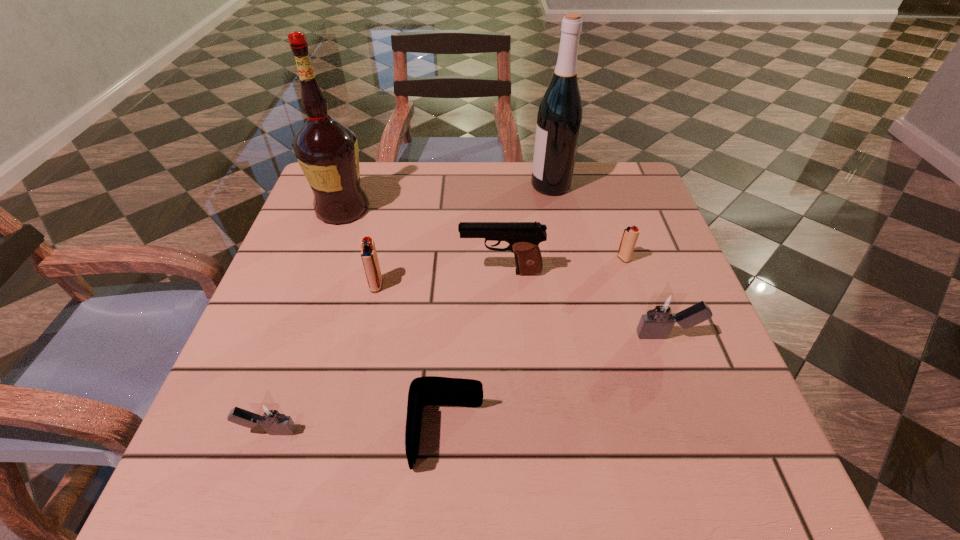
This screenshot has width=960, height=540. I want to click on free location located at the barrel of the pistol, so click(x=319, y=272).

Find the location of a particular element. The image size is (960, 540). vacant region located on the back of the bigger gray igniter is located at coordinates point(636,248).

The image size is (960, 540). Find the location of `vacant space positioned 0.210m on the right of the nearer red igniter`. vacant space positioned 0.210m on the right of the nearer red igniter is located at coordinates (484, 285).

I want to click on free space located on the front of the right red igniter, so click(x=654, y=352).

This screenshot has height=540, width=960. I want to click on vacant region located 0.200m on the back of the leftmost igniter, so (307, 319).

The width and height of the screenshot is (960, 540). What are the coordinates of `wine bottle located at the far edge` in the screenshot? It's located at (559, 118).

The height and width of the screenshot is (540, 960). Find the location of `alcohol located at the far edge`. alcohol located at the far edge is located at coordinates (327, 151).

Identify the location of igniter located at the near edge. This screenshot has height=540, width=960. (269, 414).

Where is `wallet at the near edge`? wallet at the near edge is located at coordinates [x=430, y=390].

Image resolution: width=960 pixels, height=540 pixels. In order to click on alcohol that is at the left edge in this screenshot , I will do coord(327,151).